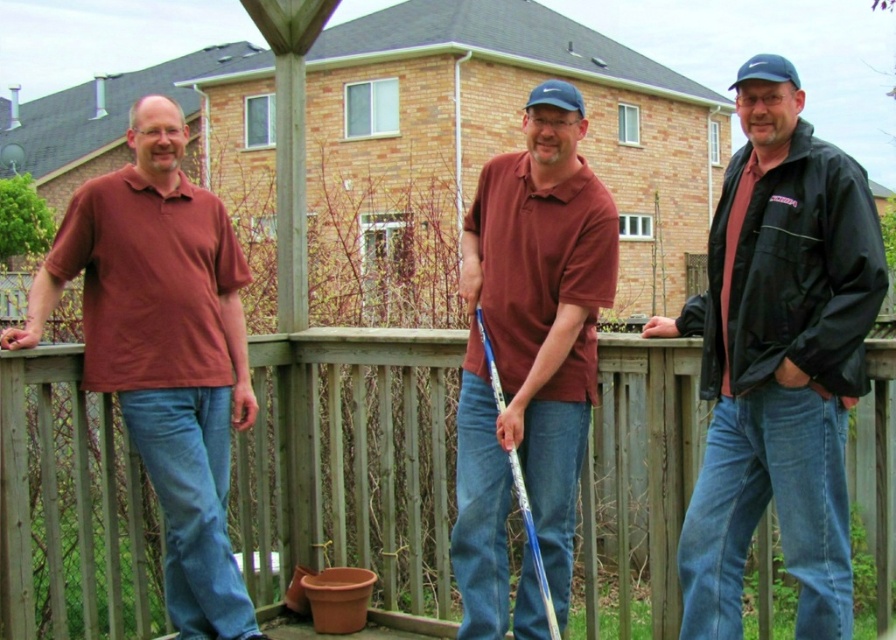
Question: Which object is closer to the camera taking this photo?

Choices:
 (A) matte red shirt at left
 (B) matte maroon polo shirt at center

Answer: (B)

Question: Which point is closer to the camera?

Choices:
 (A) (136, 240)
 (B) (507, 243)

Answer: (B)

Question: Does black matte jacket at center have a lesser width compared to matte red shirt at left?

Choices:
 (A) yes
 (B) no

Answer: (A)

Question: Does wooden railing at center have a smaller size compared to matte maroon polo shirt at center?

Choices:
 (A) no
 (B) yes

Answer: (A)

Question: Is black matte jacket at center thinner than matte red shirt at left?

Choices:
 (A) no
 (B) yes

Answer: (B)

Question: Which of the following is the farthest from the observer?

Choices:
 (A) wooden railing at center
 (B) black matte jacket at center

Answer: (A)